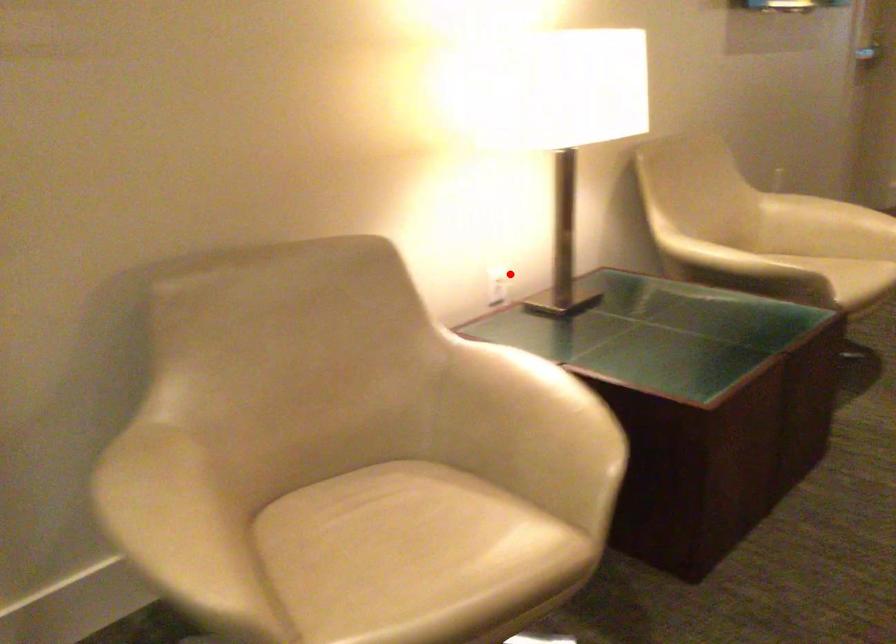
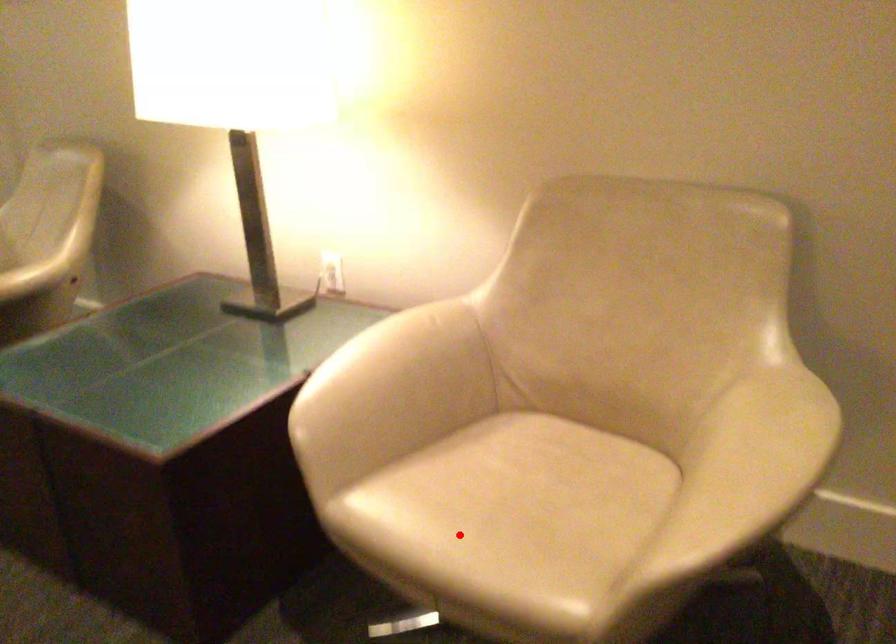
I am providing you with two images of the same scene from different viewpoints. A red point is marked on the first image and another point is marked on the second image. Do the highlighted points in image1 and image2 indicate the same real-world spot?

No